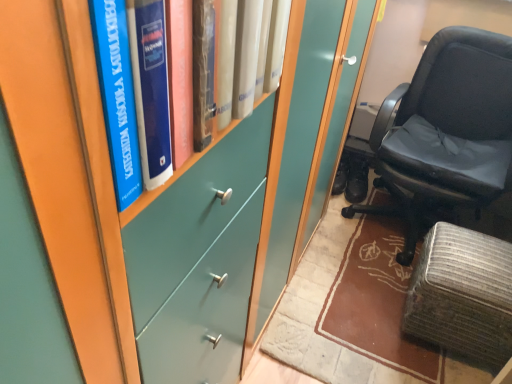
Locate an element on the screen. free space above textured gray ottoman at lower right (from a real-world perspective) is located at coordinates (479, 261).